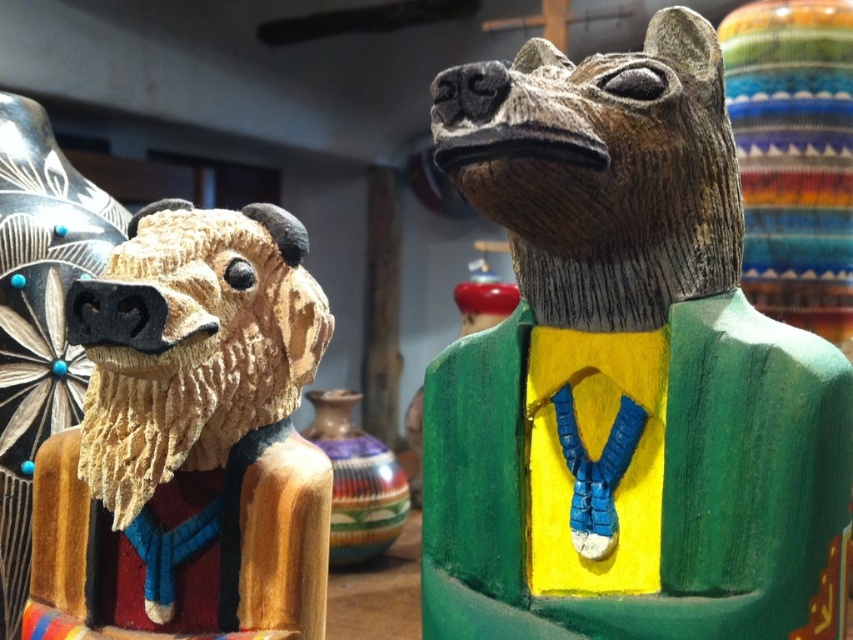
You are an art curator arranging an exhibition. You need to place a new sculpture behind the wooden bear head at left so it doesn t block the view of the multicolored clay vase at center. Where should you position the new sculpture?

The wooden bear head at left is currently in front of the multicolored clay vase at center. To place a new sculpture behind the wooden bear head at left without blocking the vase, position the new sculpture behind the wooden bear head at left so it remains visible behind.

You are an art restorer examining the two points on the sculptures. Which point, point (691, 412) or point (25, 636), is nearer to you?

Point (691, 412) is closer to the viewer than point (25, 636).

You are an interior designer planning to place a new shelf in the room. The shelf can only hold items up to the size of the multicolored clay vase at center. Can the wooden bear head at left fit on the shelf?

The wooden bear head at left is larger than the multicolored clay vase at center, so it cannot fit on the shelf designed for items up to the vase size.